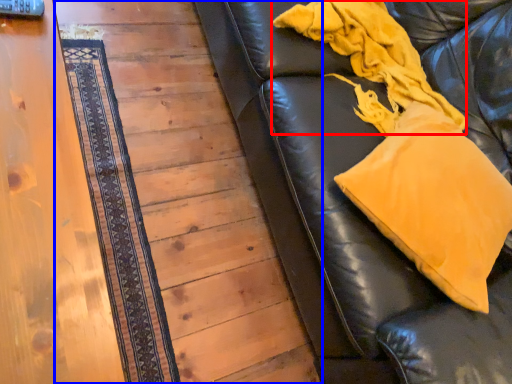
Question: Which point is closer to the camera, blanket (highlighted by a red box) or panel (highlighted by a blue box)?

Choices:
 (A) blanket
 (B) panel

Answer: (A)